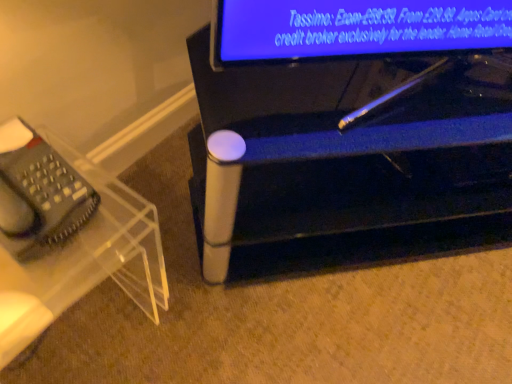
Where is `vacant space in transparent acrylic phone stand at left, arranged as the 2th furniture when viewed from the right (from a real-world perspective)`? vacant space in transparent acrylic phone stand at left, arranged as the 2th furniture when viewed from the right (from a real-world perspective) is located at coordinates (73, 299).